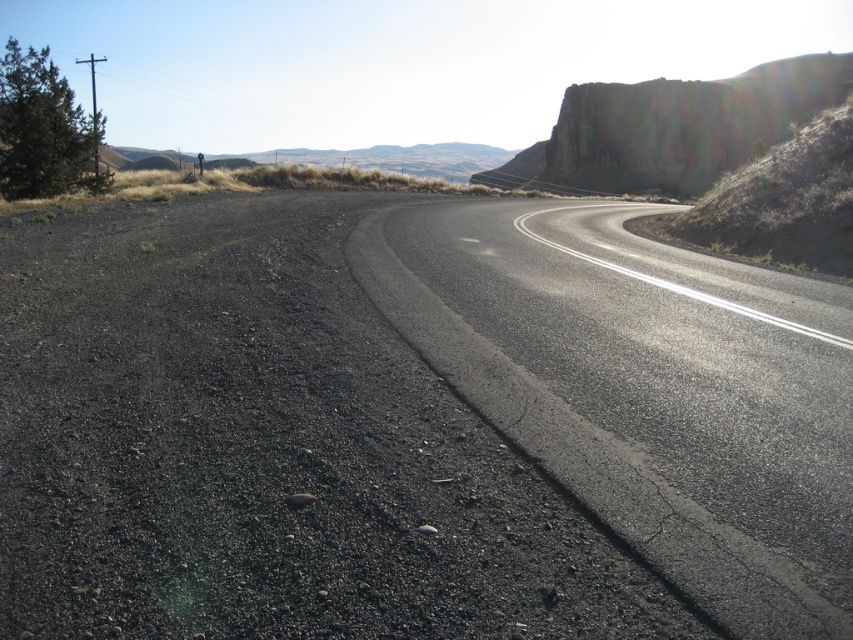
Question: Which object appears closest to the camera in this image?

Choices:
 (A) rugged rock cliff at upper right
 (B) black asphalt road at center

Answer: (B)

Question: Is black asphalt road at center to the right of rugged rock cliff at upper right from the viewer's perspective?

Choices:
 (A) yes
 (B) no

Answer: (B)

Question: Can you confirm if black asphalt road at center is positioned to the right of rugged rock cliff at upper right?

Choices:
 (A) no
 (B) yes

Answer: (A)

Question: Which point is closer to the camera?

Choices:
 (A) (654, 385)
 (B) (544, 173)

Answer: (A)

Question: Can you confirm if black asphalt road at center is thinner than rugged rock cliff at upper right?

Choices:
 (A) yes
 (B) no

Answer: (A)